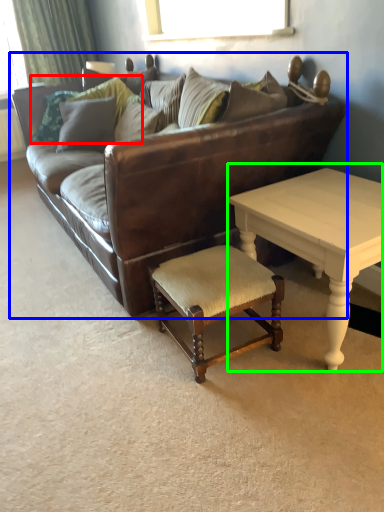
Question: Considering the real-world distances, which object is farthest from pillow (highlighted by a red box)? studio couch (highlighted by a blue box) or coffee table (highlighted by a green box)?

Choices:
 (A) studio couch
 (B) coffee table

Answer: (B)